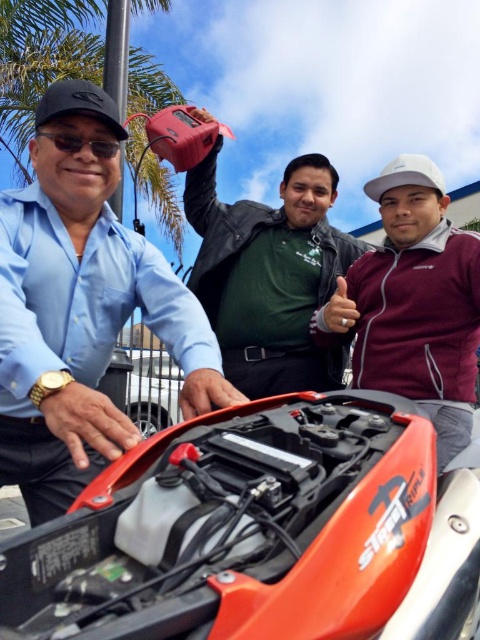
Question: Observing the image, what is the correct spatial positioning of matte black shirt at left in reference to green matte shirt at center?

Choices:
 (A) below
 (B) above

Answer: (A)

Question: Which of the following is the farthest from the observer?

Choices:
 (A) green matte shirt at center
 (B) orange matte motorcycle at center

Answer: (A)

Question: Does matte black shirt at left have a lesser width compared to green matte shirt at center?

Choices:
 (A) yes
 (B) no

Answer: (A)

Question: Estimate the real-world distances between objects in this image. Which object is farther from the orange matte motorcycle at center?

Choices:
 (A) green matte shirt at center
 (B) matte black shirt at left

Answer: (A)

Question: Is orange matte motorcycle at center above green matte shirt at center?

Choices:
 (A) yes
 (B) no

Answer: (B)

Question: Which object is the closest to the orange matte motorcycle at center?

Choices:
 (A) green matte shirt at center
 (B) matte black shirt at left

Answer: (B)